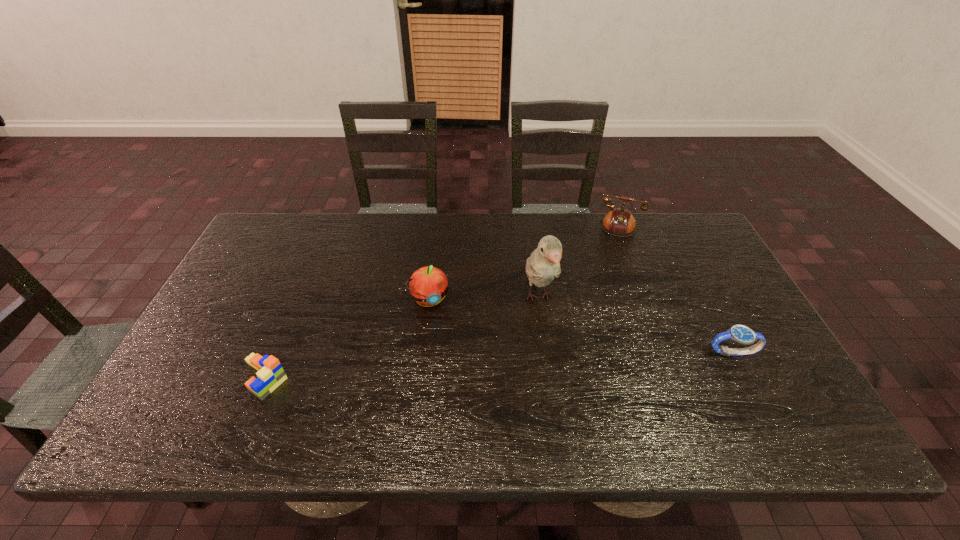
Find the location of a particular element. object at the left edge is located at coordinates (270, 374).

You are a GUI agent. You are given a task and a screenshot of the screen. Output one action in this format:
    pyautogui.click(x=<x>, y=<y>)
    Task: Click on the object located in the right edge section of the desktop
    The image size is (960, 540).
    Given the screenshot: What is the action you would take?
    pyautogui.click(x=739, y=333)

Where is `object at the near left corner`? The height and width of the screenshot is (540, 960). object at the near left corner is located at coordinates (270, 374).

In the image, there is a desktop. Identify the location of vacant space at the far edge. (486, 226).

You are a GUI agent. You are given a task and a screenshot of the screen. Output one action in this format:
    pyautogui.click(x=<x>, y=<y>)
    Task: Click on the free space at the near edge of the desktop
    This screenshot has width=960, height=540.
    Given the screenshot: What is the action you would take?
    pyautogui.click(x=361, y=396)

At what (x,y) coordinates should I click in order to perform the action: click on vacant area at the right edge. Please return your answer as a coordinate pair (x, y). The height and width of the screenshot is (540, 960). Looking at the image, I should click on (692, 308).

What are the coordinates of `free space at the near left corner of the desktop` in the screenshot? It's located at (169, 387).

The image size is (960, 540). In the image, there is a desktop. In order to click on free space at the far right corner in this screenshot , I will do `click(664, 246)`.

Where is `vacant space at the near right corner of the desktop`? vacant space at the near right corner of the desktop is located at coordinates (761, 372).

This screenshot has height=540, width=960. Identify the location of unoccupied area between the second object from left to right and the rightmost object. (581, 326).